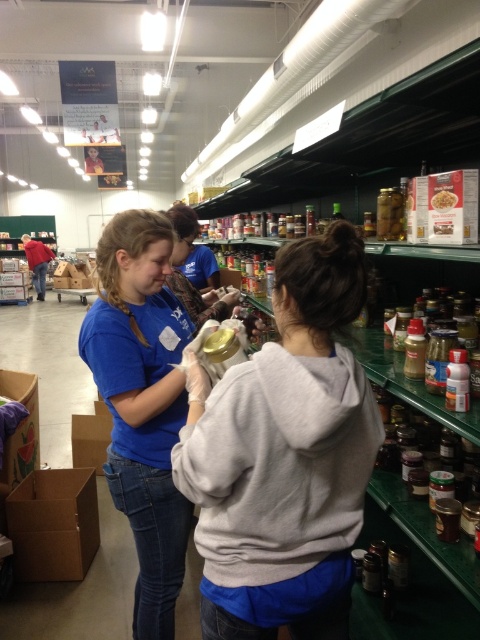
You are a volunteer at the food bank and need to place a new delivery of canned goods. The delivery truck will arrive at the entrance near the brown cardboard box at lower left. Where should you position yourself to receive the delivery?

You should position yourself near the entrance near the brown cardboard box at lower left since the delivery truck will arrive there.

You are a volunteer at the food bank and need to pack items into the brown cardboard box at lower left and the matte cardboard box at center. Which box can hold more canned goods based on their sizes?

The brown cardboard box at lower left is bigger than the matte cardboard box at center, so it can hold more canned goods.

You are a volunteer at the food bank and need to place a heavy item on the box that is closer to you. Which box should you choose between the brown cardboard box at lower left and the matte cardboard box at center?

The brown cardboard box at lower left is closer to you, so you should choose the brown cardboard box at lower left to place the heavy item.